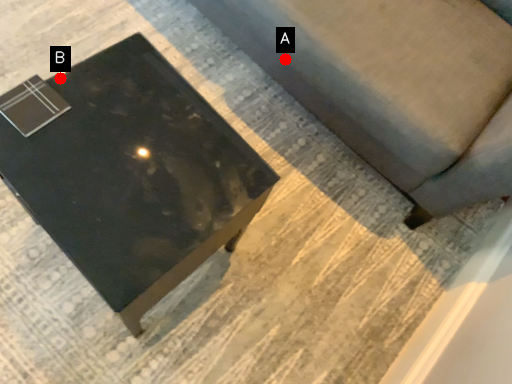
Question: Two points are circled on the image, labeled by A and B beside each circle. Among these points, which one is nearest to the camera?

Choices:
 (A) A is closer
 (B) B is closer

Answer: (B)